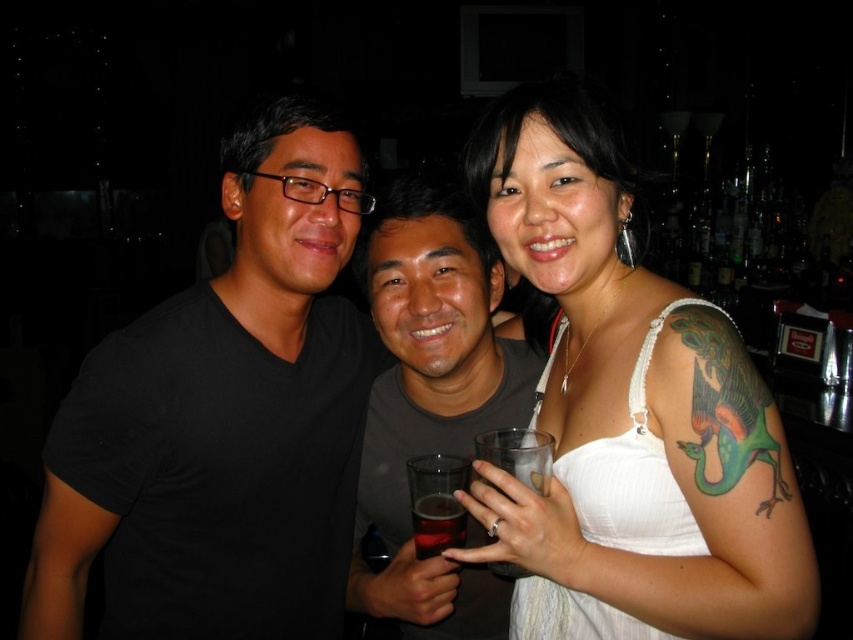
You are a photographer trying to adjust the lighting for a photo shoot in a bar. You notice the white fabric dress at center and the translucent glass at center in the scene. Which object should you focus on first if you want to ensure proper exposure, considering their size in the frame?

The white fabric dress at center is taller than the translucent glass at center, so focusing on the larger white fabric dress at center first would help ensure proper exposure for the main subject.